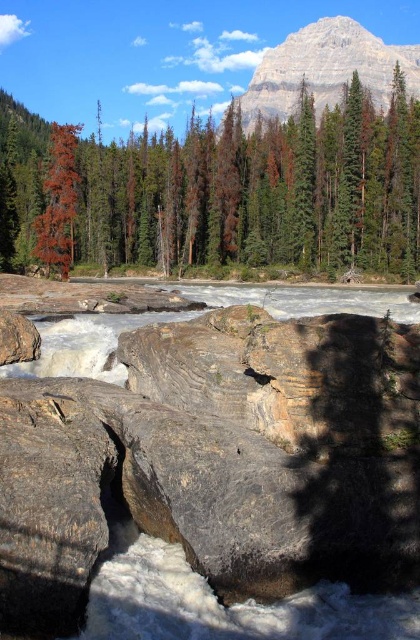
Question: Is dead wood trees at upper left positioned at the back of reddish-brown bark tree at left?

Choices:
 (A) no
 (B) yes

Answer: (B)

Question: Estimate the real-world distances between objects in this image. Which object is closer to the reddish-brown bark tree at left?

Choices:
 (A) dead wood trees at upper left
 (B) rocky beige mountain at upper center

Answer: (A)

Question: Which point is closer to the camera?

Choices:
 (A) (63, 236)
 (B) (275, 205)
 (C) (286, 76)

Answer: (A)

Question: Considering the relative positions of dead wood trees at upper left and reddish-brown bark tree at left in the image provided, where is dead wood trees at upper left located with respect to reddish-brown bark tree at left?

Choices:
 (A) right
 (B) left

Answer: (B)

Question: Can you confirm if dead wood trees at upper left is smaller than rocky beige mountain at upper center?

Choices:
 (A) yes
 (B) no

Answer: (A)

Question: Which of the following is the closest to the observer?

Choices:
 (A) reddish-brown bark tree at left
 (B) rocky beige mountain at upper center
 (C) dead wood trees at upper left

Answer: (A)